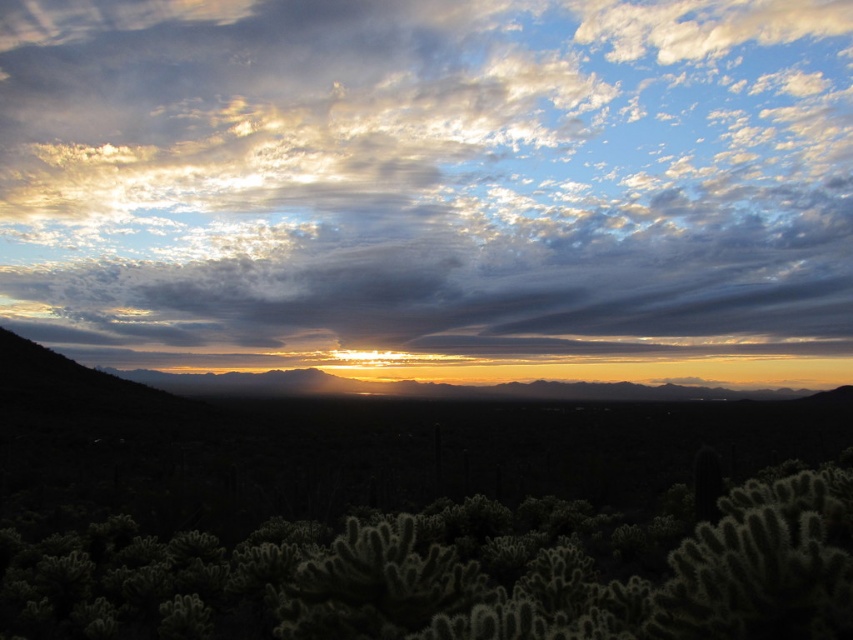
Between cloudy sky at upper center and green spiky cactus at lower center, which one has more height?

Standing taller between the two is cloudy sky at upper center.

Can you confirm if cloudy sky at upper center is shorter than green spiky cactus at lower center?

No.

Does point (426, 275) come farther from viewer compared to point (294, 560)?

Yes.

You are a GUI agent. You are given a task and a screenshot of the screen. Output one action in this format:
    pyautogui.click(x=<x>, y=<y>)
    Task: Click on the cloudy sky at upper center
    The width and height of the screenshot is (853, 640).
    Given the screenshot: What is the action you would take?
    pyautogui.click(x=427, y=177)